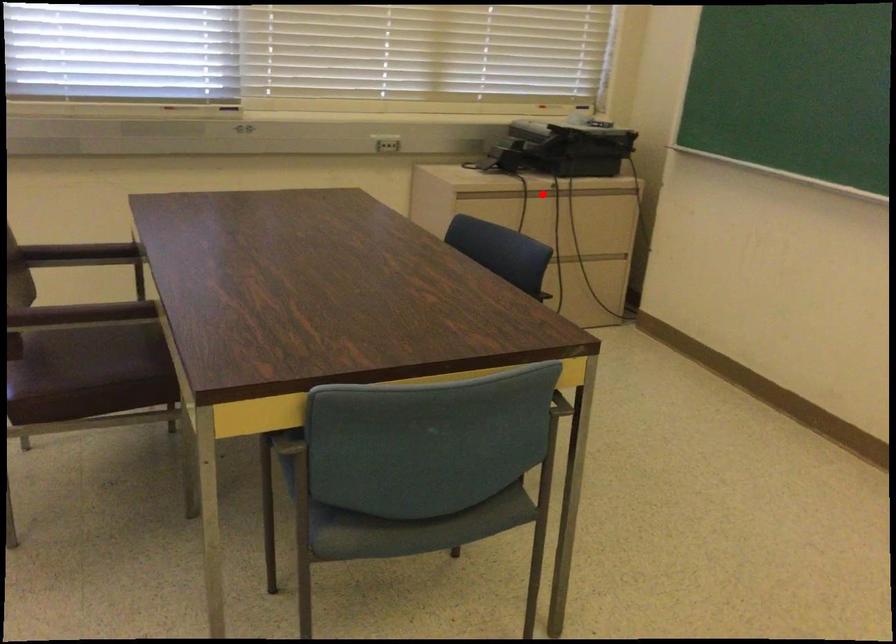
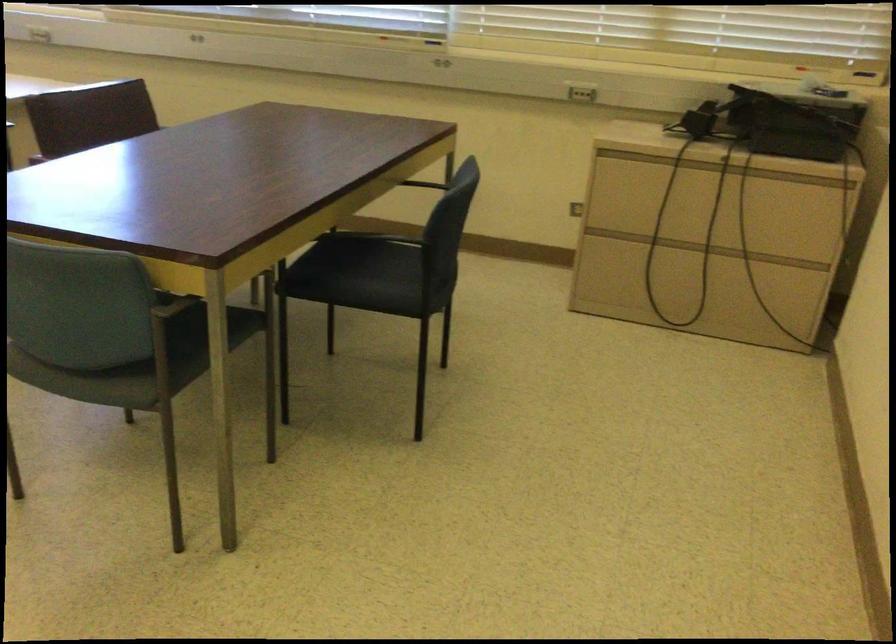
Question: I am providing you with two images of the same scene from different viewpoints. A red point is shown in image1. For the corresponding object point in image2, is it positioned nearer or farther from the camera?

Choices:
 (A) Nearer
 (B) Farther

Answer: (A)